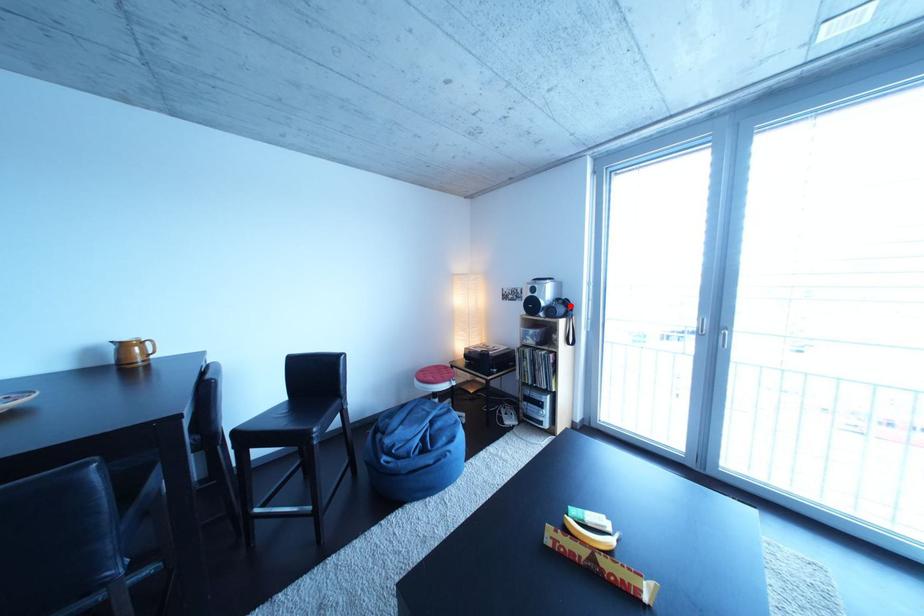
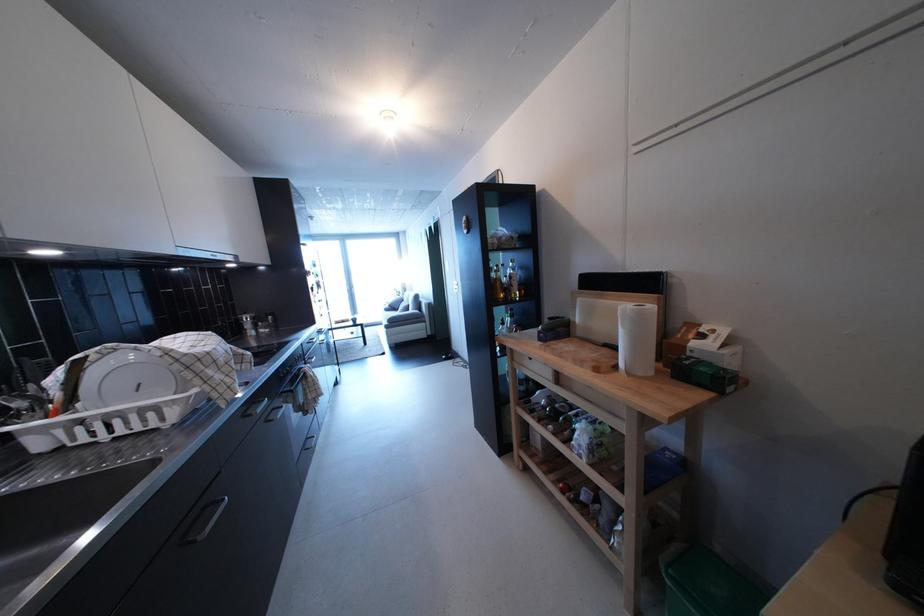
Question: I am providing you with two images of the same scene from different viewpoints. A red point is marked on the first image. Can you still see the location of the red point in image 2?

Choices:
 (A) Yes
 (B) No

Answer: (B)